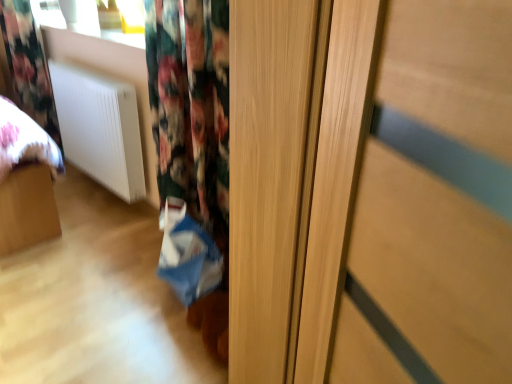
What do you see at coordinates (28, 66) in the screenshot? I see `floral fabric curtain at upper left` at bounding box center [28, 66].

Measure the distance between floral fabric curtain at upper left and camera.

floral fabric curtain at upper left is 2.67 meters away from camera.

Image resolution: width=512 pixels, height=384 pixels. I want to click on white matte radiator at lower left, so click(x=100, y=128).

Image resolution: width=512 pixels, height=384 pixels. What are the coordinates of `blue fabric shopping bag at lower center` in the screenshot? It's located at coord(187,254).

The image size is (512, 384). What are the coordinates of `floral fabric curtain at upper left` in the screenshot? It's located at (28, 66).

Which object is positioned more to the left, white matte radiator at lower left or floral fabric curtain at upper left?

Positioned to the left is floral fabric curtain at upper left.

Is white matte radiator at lower left facing towards floral fabric curtain at upper left?

No, white matte radiator at lower left is not aimed at floral fabric curtain at upper left.

Is white matte radiator at lower left inside the boundaries of floral fabric curtain at upper left, or outside?

The correct answer is: outside.

Is the position of white matte radiator at lower left less distant than that of floral fabric curtain at upper left?

That is True.

Considering the sizes of objects white matte radiator at lower left and blue fabric shopping bag at lower center in the image provided, who is wider, white matte radiator at lower left or blue fabric shopping bag at lower center?

blue fabric shopping bag at lower center is wider.

The image size is (512, 384). Identify the location of radiator on the left of blue fabric shopping bag at lower center. (100, 128).

Which is behind, white matte radiator at lower left or blue fabric shopping bag at lower center?

white matte radiator at lower left is behind.

Is point (113, 162) farther from viewer compared to point (202, 259)?

That is True.

Based on the photo, can you confirm if blue fabric shopping bag at lower center is wider than floral fabric curtain at upper left?

Yes, blue fabric shopping bag at lower center is wider than floral fabric curtain at upper left.

Considering the sizes of objects blue fabric shopping bag at lower center and floral fabric curtain at upper left in the image provided, who is taller, blue fabric shopping bag at lower center or floral fabric curtain at upper left?

floral fabric curtain at upper left is taller.

Where is `curtain that appears on the left of blue fabric shopping bag at lower center`? The height and width of the screenshot is (384, 512). curtain that appears on the left of blue fabric shopping bag at lower center is located at coordinates (28, 66).

Consider the image. Considering the sizes of floral fabric curtain at upper left and white matte radiator at lower left in the image, is floral fabric curtain at upper left taller or shorter than white matte radiator at lower left?

floral fabric curtain at upper left is taller than white matte radiator at lower left.

From the image's perspective, is floral fabric curtain at upper left located above or below white matte radiator at lower left?

floral fabric curtain at upper left is situated higher than white matte radiator at lower left in the image.

Is floral fabric curtain at upper left outside of white matte radiator at lower left?

Yes, floral fabric curtain at upper left is not within white matte radiator at lower left.

Is floral fabric curtain at upper left at the right side of white matte radiator at lower left?

Incorrect, floral fabric curtain at upper left is not on the right side of white matte radiator at lower left.

Is blue fabric shopping bag at lower center placed right next to white matte radiator at lower left?

No, blue fabric shopping bag at lower center is not touching white matte radiator at lower left.

Is blue fabric shopping bag at lower center situated inside white matte radiator at lower left or outside?

blue fabric shopping bag at lower center is not enclosed by white matte radiator at lower left.

From a real-world perspective, is blue fabric shopping bag at lower center physically located above or below white matte radiator at lower left?

In terms of real-world spatial position, blue fabric shopping bag at lower center is below white matte radiator at lower left.

Is blue fabric shopping bag at lower center positioned behind white matte radiator at lower left?

No, it is not.

From the image's perspective, is floral fabric curtain at upper left below blue fabric shopping bag at lower center?

No.

Between floral fabric curtain at upper left and blue fabric shopping bag at lower center, which one appears on the left side from the viewer's perspective?

floral fabric curtain at upper left is more to the left.

Where is `curtain that is behind the blue fabric shopping bag at lower center`? Image resolution: width=512 pixels, height=384 pixels. curtain that is behind the blue fabric shopping bag at lower center is located at coordinates (28, 66).

From a real-world perspective, which object rests below the other?

In real-world perspective, blue fabric shopping bag at lower center is lower.

I want to click on radiator in front of the floral fabric curtain at upper left, so click(x=100, y=128).

This screenshot has width=512, height=384. Find the location of `radiator behind the blue fabric shopping bag at lower center`. radiator behind the blue fabric shopping bag at lower center is located at coordinates (100, 128).

Looking at the image, which one is located closer to white matte radiator at lower left, floral fabric curtain at upper left or blue fabric shopping bag at lower center?

The object closer to white matte radiator at lower left is floral fabric curtain at upper left.

When comparing their distances from blue fabric shopping bag at lower center, does floral fabric curtain at upper left or white matte radiator at lower left seem further?

floral fabric curtain at upper left lies further to blue fabric shopping bag at lower center than the other object.

Which object lies further to the anchor point blue fabric shopping bag at lower center, white matte radiator at lower left or floral fabric curtain at upper left?

floral fabric curtain at upper left is further to blue fabric shopping bag at lower center.

Which object lies nearer to the anchor point white matte radiator at lower left, blue fabric shopping bag at lower center or floral fabric curtain at upper left?

Based on the image, floral fabric curtain at upper left appears to be nearer to white matte radiator at lower left.

When comparing their distances from floral fabric curtain at upper left, does blue fabric shopping bag at lower center or white matte radiator at lower left seem further?

blue fabric shopping bag at lower center.

Looking at the image, which one is located further to floral fabric curtain at upper left, white matte radiator at lower left or blue fabric shopping bag at lower center?

blue fabric shopping bag at lower center.

You are a GUI agent. You are given a task and a screenshot of the screen. Output one action in this format:
    pyautogui.click(x=<x>, y=<y>)
    Task: Click on the radiator between floral fabric curtain at upper left and blue fabric shopping bag at lower center from left to right
    The width and height of the screenshot is (512, 384).
    Given the screenshot: What is the action you would take?
    pyautogui.click(x=100, y=128)